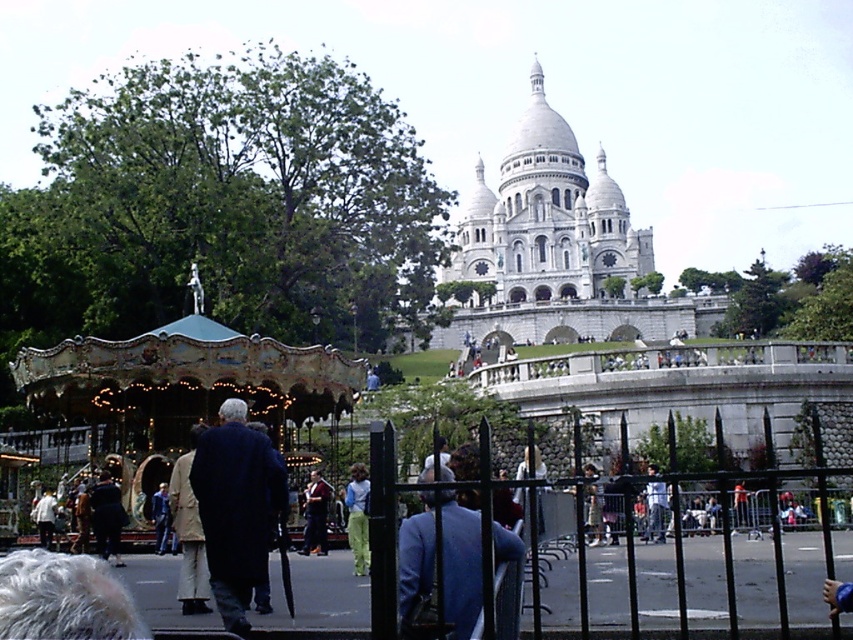
Question: Is white stone palace at upper center smaller than green textured pants at center?

Choices:
 (A) no
 (B) yes

Answer: (A)

Question: Considering the real-world distances, which object is farthest from the white stone palace at upper center?

Choices:
 (A) light blue jeans at center
 (B) dark blue coat at center
 (C) blue fabric jacket at center
 (D) dark blue jeans at center

Answer: (C)

Question: Which of the following is the farthest from the observer?

Choices:
 (A) (361, 572)
 (B) (796, 573)
 (C) (247, 582)

Answer: (A)

Question: Can you confirm if black metal fence at center is positioned to the left of green textured pants at center?

Choices:
 (A) no
 (B) yes

Answer: (A)

Question: Can you confirm if blue fabric jacket at center is positioned to the left of green textured pants at center?

Choices:
 (A) yes
 (B) no

Answer: (B)

Question: Which point appears farthest from the camera in this image?

Choices:
 (A) (312, 518)
 (B) (355, 570)
 (C) (648, 509)

Answer: (C)